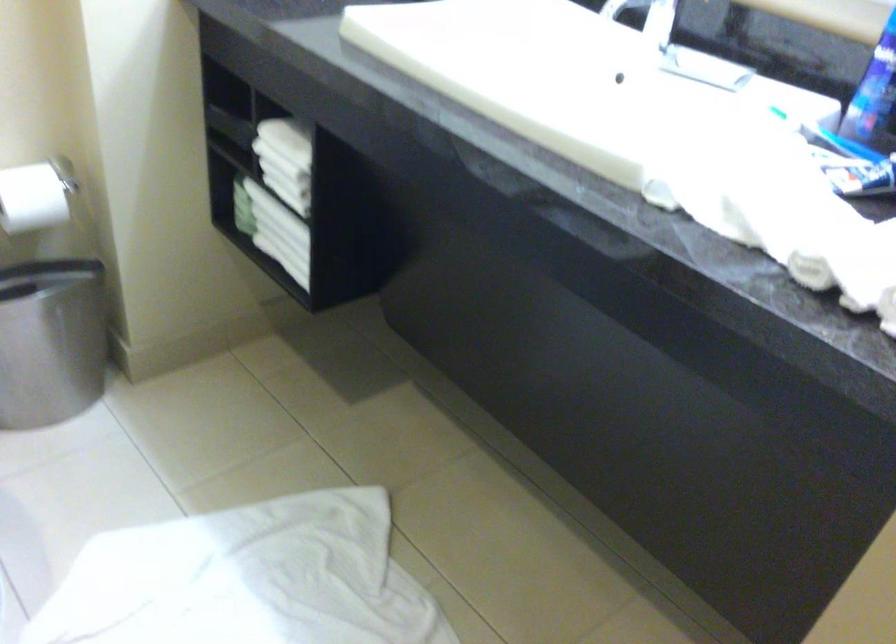
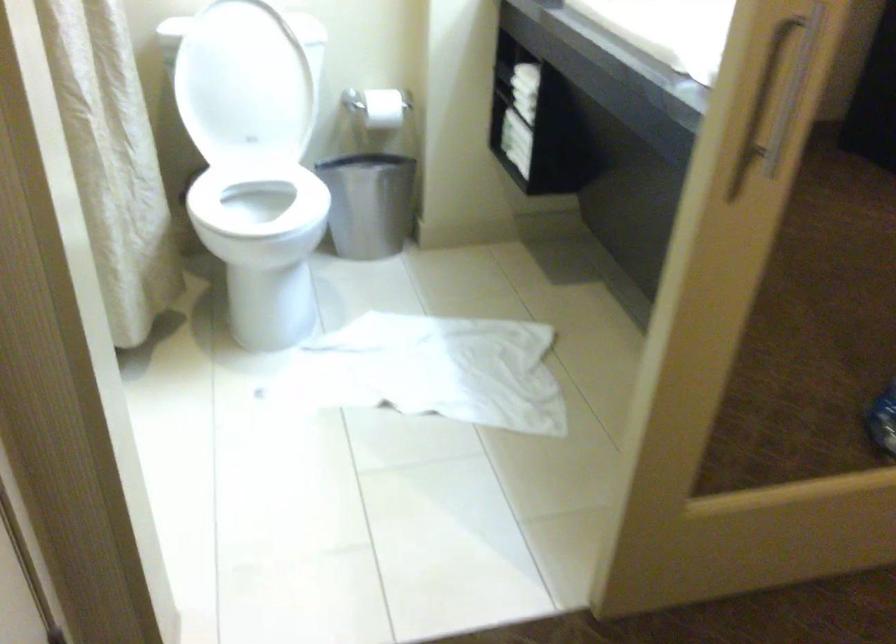
Question: The images are taken continuously from a first-person perspective. In which direction is your viewpoint rotating?

Choices:
 (A) Left
 (B) Right
 (C) Up
 (D) Down

Answer: (A)